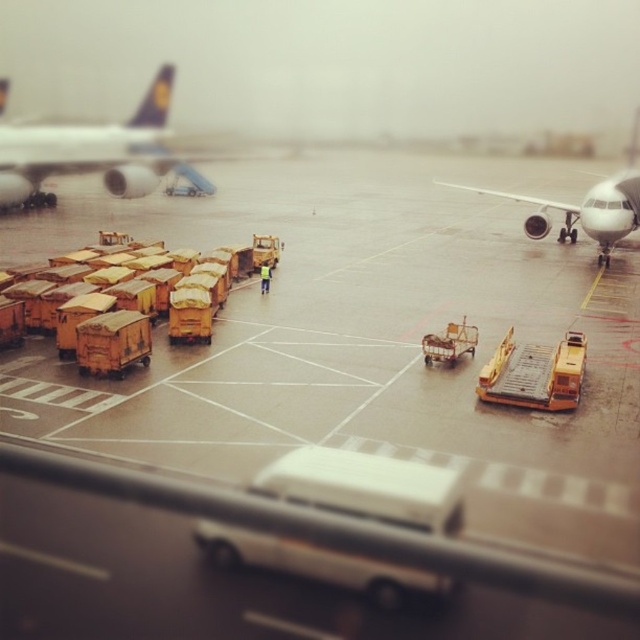
You are a photographer positioned on the airport tarmac. You want to take a picture of the metallic yellow cart at center but also want the white glossy airplane at upper left to be visible in the background. Based on their positions, is this possible?

Yes, because the white glossy airplane at upper left is to the left of the metallic yellow cart at center, so it can be included in the background of the photo.

You are a photographer standing on the airport tarmac and want to take a photo of the white glossy airplane at upper left and the metallic yellow cart at center. Which object should you focus on if you want the other to appear blurred in the background?

The white glossy airplane at upper left is positioned over metallic yellow cart at center, so if you focus on the white glossy airplane at upper left, the metallic yellow cart at center will appear blurred in the background.

You are an airport ground crew member who needs to park a new airplane. You see the white glossy airplane at upper left and the white glossy airplane at right. Which airplane has a smaller width to consider for parking space?

The white glossy airplane at upper left has a smaller width than the white glossy airplane at right, so it requires less space for parking.